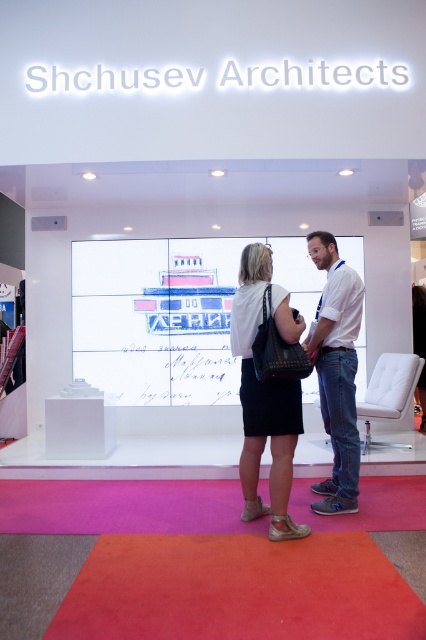
You are an event planner at the exhibition and need to guide a guest to the exit located behind the white cotton shirt at center. The guest is currently standing near the white matte skirt at center. Which direction should the guest move to reach the exit?

The guest should move to the right because the white cotton shirt at center is to the right of the white matte skirt at center, and the exit is behind it.

You are an event organizer at the exhibition and need to determine the appropriate size of a gift bag for attendees. The gift bag must fit both the white matte skirt at center and the white cotton shirt at center. Based on their sizes, what should be the minimum dimensions of the gift bag?

The white matte skirt at center is smaller than the white cotton shirt at center. Therefore, the gift bag should be at least as large as the white cotton shirt at center to accommodate both items.

You are a photographer standing in the exhibition space and want to take a closeup photo of both the white matte skirt at center and the white cotton shirt at center. Can you fit both items in the frame if your camera has a minimum focus distance of 18 inches?

The white matte skirt at center and white cotton shirt at center are 20.29 inches apart, so yes, the camera can focus on both items since the distance between them is greater than the minimum focus distance of 18 inches.